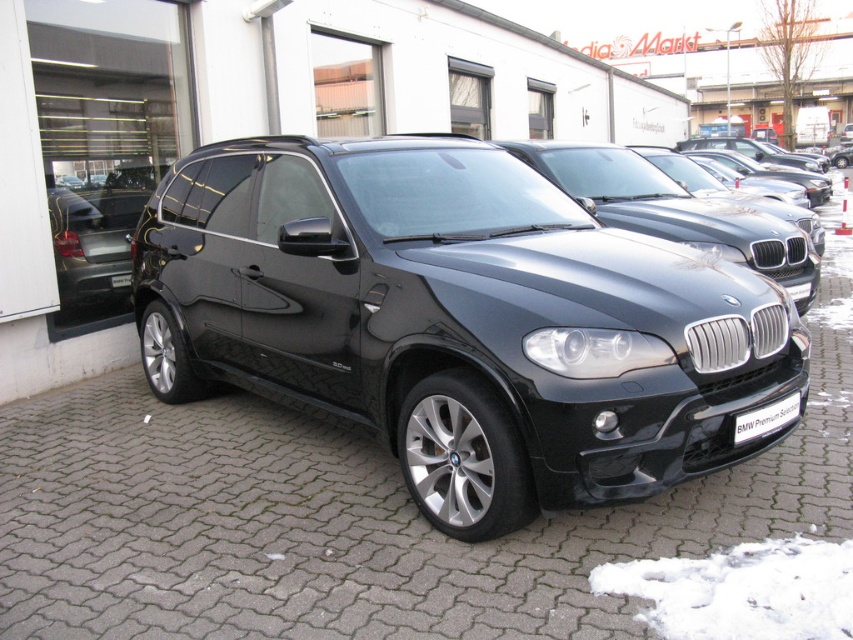
Question: Which object appears closest to the camera in this image?

Choices:
 (A) black plastic license plate at center
 (B) matte black suv at center

Answer: (B)

Question: Which object is farther from the camera taking this photo?

Choices:
 (A) black plastic license plate at center
 (B) matte black suv at center

Answer: (A)

Question: Can you confirm if matte black suv at center is positioned above black plastic license plate at center?

Choices:
 (A) yes
 (B) no

Answer: (A)

Question: Does matte black suv at center have a larger size compared to black plastic license plate at center?

Choices:
 (A) yes
 (B) no

Answer: (A)

Question: From the image, what is the correct spatial relationship of matte black suv at center in relation to black plastic license plate at center?

Choices:
 (A) right
 (B) left

Answer: (B)